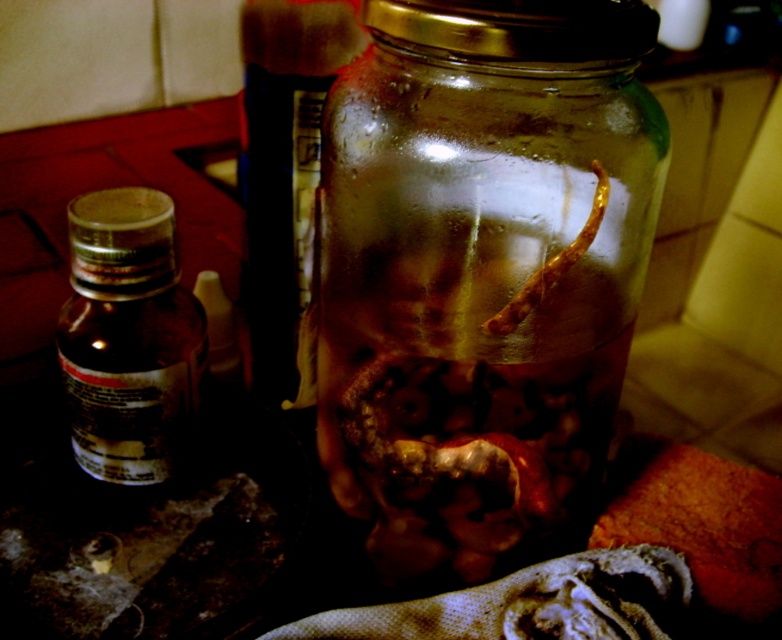
You are a pharmacist preparing a medication that requires precise measurements. You have a transparent glass jar at center and a brown matte bottle at left on the countertop. You need to place a 4.5 inch wide measuring tool between them. Will there be enough space?

The transparent glass jar at center and brown matte bottle at left are 3.97 inches apart from each other. Since the measuring tool is 4.5 inches wide, which is wider than the space between them, there is not enough space to place the tool between them.

Consider the image. You are organizing items on a kitchen counter and see the transparent glass jar at center and the brown matte bottle at left. Which item is positioned more to the right side of the counter?

The transparent glass jar at center is positioned more to the right side of the counter than the brown matte bottle at left.

You are a pharmacist preparing a medication. You have a transparent glass jar at center and a brown matte bottle at left on the countertop. Which item is placed higher up in the arrangement?

The transparent glass jar at center is positioned over the brown matte bottle at left, so it is placed higher up in the arrangement.